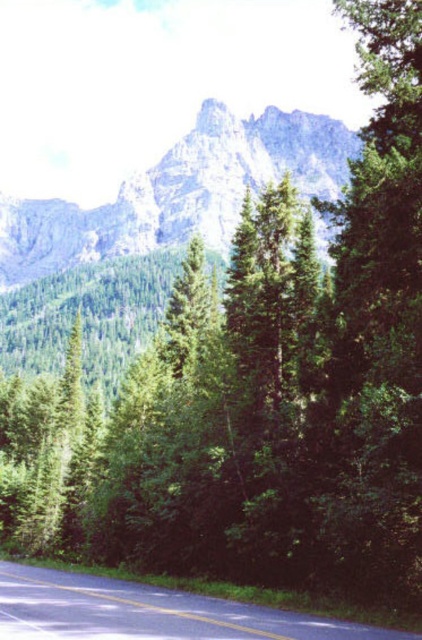
Does point (194, 225) come behind point (167, 589)?

Yes, it is behind point (167, 589).

Which is behind, point (229, 160) or point (181, 600)?

Point (229, 160)

Find the location of `gray rocky mountain at upper center`. gray rocky mountain at upper center is located at coordinates pos(178,193).